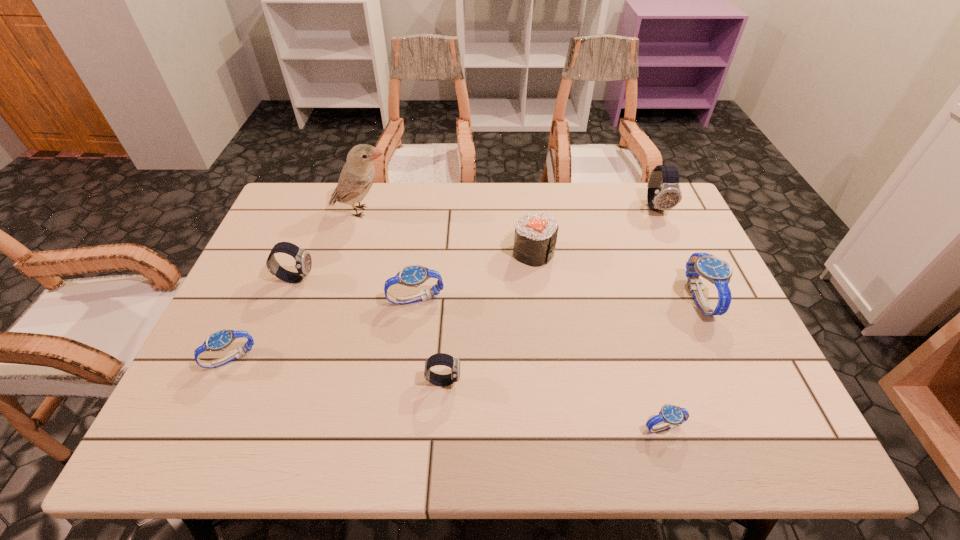
You are a GUI agent. You are given a task and a screenshot of the screen. Output one action in this format:
    pyautogui.click(x=<x>, y=<y>)
    Task: Click on the object present at the far right corner
    
    Given the screenshot: What is the action you would take?
    click(663, 193)

The image size is (960, 540). In order to click on vacant space at the far edge of the desktop in this screenshot , I will do 379,197.

Where is `free space at the near edge`? free space at the near edge is located at coordinates (268, 444).

Image resolution: width=960 pixels, height=540 pixels. Identify the location of vacant area at the right edge of the desktop. (714, 339).

The height and width of the screenshot is (540, 960). In the image, there is a desktop. What are the coordinates of `vacant space at the near left corner` in the screenshot? It's located at (206, 413).

At what (x,y) coordinates should I click in order to perform the action: click on vacant space at the far right corner of the desktop. Please return your answer as a coordinate pair (x, y). The width and height of the screenshot is (960, 540). Looking at the image, I should click on (638, 214).

Where is `vacant space in between the bird and the second biggest dark watch`? This screenshot has width=960, height=540. vacant space in between the bird and the second biggest dark watch is located at coordinates (329, 245).

Where is `empty location between the nearest blue watch and the nearest dark watch`? The width and height of the screenshot is (960, 540). empty location between the nearest blue watch and the nearest dark watch is located at coordinates (554, 404).

Find the location of `vacant region between the biggest blue watch and the third object from right to left`. vacant region between the biggest blue watch and the third object from right to left is located at coordinates (682, 362).

I want to click on free area in between the third smallest blue watch and the nearest dark watch, so click(x=430, y=340).